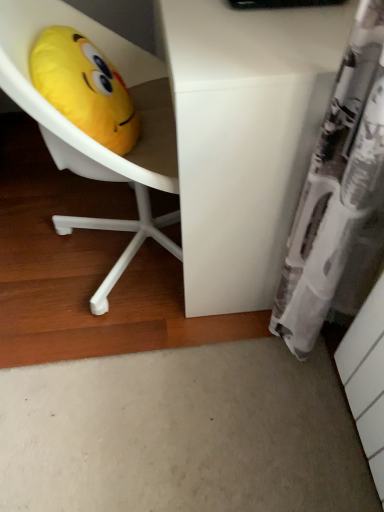
The image size is (384, 512). What do you see at coordinates (84, 88) in the screenshot?
I see `yellow plush toy at upper left` at bounding box center [84, 88].

Where is `yellow plush toy at upper left`? yellow plush toy at upper left is located at coordinates (84, 88).

What do you see at coordinates (245, 137) in the screenshot? Image resolution: width=384 pixels, height=512 pixels. I see `white matte desk at center` at bounding box center [245, 137].

Where is `white matte desk at center`? Image resolution: width=384 pixels, height=512 pixels. white matte desk at center is located at coordinates (245, 137).

Measure the distance between white matte desk at center and camera.

They are 26.91 inches apart.

You are a GUI agent. You are given a task and a screenshot of the screen. Output one action in this format:
    pyautogui.click(x=<x>, y=<y>)
    Task: Click on the yellow plush toy at upper left
    The image size is (384, 512).
    Given the screenshot: What is the action you would take?
    pyautogui.click(x=84, y=88)

Is white matte desk at center to the right of yellow plush toy at upper left from the viewer's perspective?

Indeed, white matte desk at center is positioned on the right side of yellow plush toy at upper left.

Is white matte desk at center positioned before yellow plush toy at upper left?

Yes, white matte desk at center is closer to the viewer.

Which is behind, point (223, 275) or point (97, 60)?

Positioned behind is point (223, 275).

From the image's perspective, who appears lower, white matte desk at center or yellow plush toy at upper left?

yellow plush toy at upper left is shown below in the image.

From a real-world perspective, who is located lower, white matte desk at center or yellow plush toy at upper left?

From a 3D spatial view, white matte desk at center is below.

Can you confirm if white matte desk at center is wider than yellow plush toy at upper left?

Correct, the width of white matte desk at center exceeds that of yellow plush toy at upper left.

Can you confirm if white matte desk at center is shorter than yellow plush toy at upper left?

In fact, white matte desk at center may be taller than yellow plush toy at upper left.

Is white matte desk at center bigger or smaller than yellow plush toy at upper left?

white matte desk at center is bigger than yellow plush toy at upper left.

Is white matte desk at center inside the boundaries of yellow plush toy at upper left, or outside?

white matte desk at center is spatially situated outside yellow plush toy at upper left.

Is white matte desk at center directly adjacent to yellow plush toy at upper left?

No, white matte desk at center is not with yellow plush toy at upper left.

Based on the photo, could you tell me if white matte desk at center is turned towards yellow plush toy at upper left?

Yes, white matte desk at center faces towards yellow plush toy at upper left.

From the picture: How different are the orientations of white matte desk at center and yellow plush toy at upper left in degrees?

white matte desk at center and yellow plush toy at upper left are facing 180 degrees away from each other.

Where is `toy on the left side of white matte desk at center`? The image size is (384, 512). toy on the left side of white matte desk at center is located at coordinates [x=84, y=88].

Considering the relative positions of yellow plush toy at upper left and white matte desk at center in the image provided, is yellow plush toy at upper left to the right of white matte desk at center from the viewer's perspective?

No, yellow plush toy at upper left is not to the right of white matte desk at center.

Between yellow plush toy at upper left and white matte desk at center, which one is positioned behind?

yellow plush toy at upper left.

Between point (125, 151) and point (216, 77), which one is positioned in front?

Positioned in front is point (216, 77).

From the image's perspective, is yellow plush toy at upper left located beneath white matte desk at center?

Indeed, from the image's perspective, yellow plush toy at upper left is shown beneath white matte desk at center.

From a real-world perspective, which object rests below the other?

white matte desk at center is physically lower.

Consider the image. Considering the relative sizes of yellow plush toy at upper left and white matte desk at center in the image provided, is yellow plush toy at upper left thinner than white matte desk at center?

Indeed, yellow plush toy at upper left has a lesser width compared to white matte desk at center.

Is yellow plush toy at upper left shorter than white matte desk at center?

Yes.

Considering the sizes of objects yellow plush toy at upper left and white matte desk at center in the image provided, who is bigger, yellow plush toy at upper left or white matte desk at center?

With larger size is white matte desk at center.

Is yellow plush toy at upper left located outside white matte desk at center?

That's correct, yellow plush toy at upper left is outside of white matte desk at center.

Is yellow plush toy at upper left in contact with white matte desk at center?

yellow plush toy at upper left is not next to white matte desk at center, and they're not touching.

Could you tell me if yellow plush toy at upper left is turned towards white matte desk at center?

Yes, yellow plush toy at upper left is facing white matte desk at center.

I want to click on desk in front of the yellow plush toy at upper left, so click(245, 137).

Where is `toy above the white matte desk at center (from a real-world perspective)`? toy above the white matte desk at center (from a real-world perspective) is located at coordinates pyautogui.click(x=84, y=88).

Where is `desk beneath the yellow plush toy at upper left (from a real-world perspective)`? The height and width of the screenshot is (512, 384). desk beneath the yellow plush toy at upper left (from a real-world perspective) is located at coordinates (245, 137).